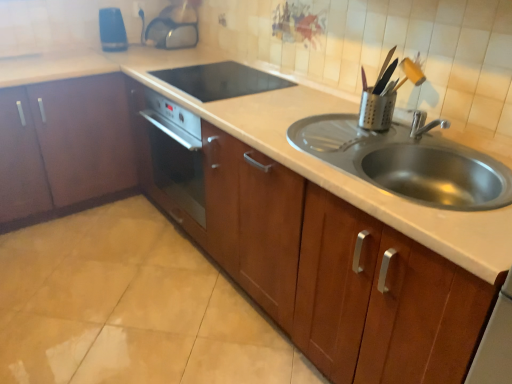
Question: Is transparent plastic kettle at upper center, the 1th appliance viewed from the back, inside black glass cooktop at center, which is counted as the 3th appliance, starting from the back?

Choices:
 (A) yes
 (B) no

Answer: (B)

Question: Would you say black glass cooktop at center, which ranks as the 2th appliance in right-to-left order, is outside transparent plastic kettle at upper center, the 1th appliance viewed from the back?

Choices:
 (A) yes
 (B) no

Answer: (A)

Question: Does black glass cooktop at center, the second appliance viewed from the front, have a greater height compared to transparent plastic kettle at upper center, the third appliance viewed from the right?

Choices:
 (A) no
 (B) yes

Answer: (A)

Question: From a real-world perspective, is black glass cooktop at center, which is counted as the 3th appliance, starting from the back, positioned over transparent plastic kettle at upper center, placed as the fourth appliance when sorted from front to back, based on gravity?

Choices:
 (A) no
 (B) yes

Answer: (A)

Question: Is black glass cooktop at center, which is the 3th appliance in left-to-right order, wider than transparent plastic kettle at upper center, the 1th appliance viewed from the back?

Choices:
 (A) yes
 (B) no

Answer: (A)

Question: Could you tell me if black glass cooktop at center, which is the 3th appliance in left-to-right order, is facing transparent plastic kettle at upper center, the third appliance viewed from the right?

Choices:
 (A) yes
 (B) no

Answer: (B)

Question: Is blue plastic toaster at upper left, which ranks as the fourth appliance in right-to-left order, located within wooden cabinet at center, the 2th cabinetry positioned from the left?

Choices:
 (A) no
 (B) yes

Answer: (A)

Question: Is wooden cabinet at center, the 2th cabinetry positioned from the left, shorter than blue plastic toaster at upper left, which ranks as the second appliance in back-to-front order?

Choices:
 (A) no
 (B) yes

Answer: (A)

Question: Can you confirm if wooden cabinet at center, the 2th cabinetry positioned from the left, is bigger than blue plastic toaster at upper left, which ranks as the second appliance in back-to-front order?

Choices:
 (A) yes
 (B) no

Answer: (A)

Question: Does wooden cabinet at center, which is counted as the 1th cabinetry, starting from the right, have a greater width compared to blue plastic toaster at upper left, the first appliance viewed from the left?

Choices:
 (A) yes
 (B) no

Answer: (A)

Question: Considering the relative positions of wooden cabinet at center, the 2th cabinetry positioned from the left, and blue plastic toaster at upper left, which is the 3th appliance from front to back, in the image provided, is wooden cabinet at center, the 2th cabinetry positioned from the left, to the right of blue plastic toaster at upper left, which is the 3th appliance from front to back, from the viewer's perspective?

Choices:
 (A) yes
 (B) no

Answer: (A)

Question: Can you confirm if wooden cabinet at center, the 2th cabinetry positioned from the left, is smaller than blue plastic toaster at upper left, which ranks as the second appliance in back-to-front order?

Choices:
 (A) no
 (B) yes

Answer: (A)

Question: Can we say wooden cabinet at center, which is counted as the 1th cabinetry, starting from the right, lies outside black glass cooktop at center, which is the 3th appliance in left-to-right order?

Choices:
 (A) no
 (B) yes

Answer: (B)